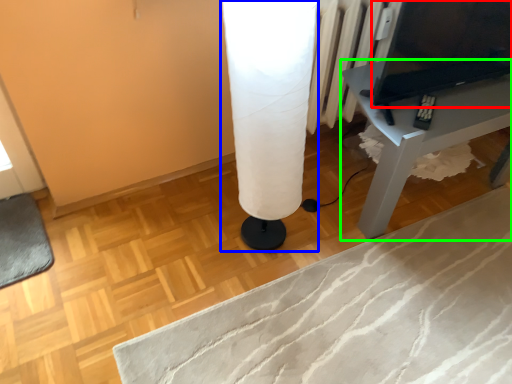
Question: Which object is the farthest from computer (highlighted by a red box)? Choose among these: table lamp (highlighted by a blue box) or table (highlighted by a green box).

Choices:
 (A) table lamp
 (B) table

Answer: (A)